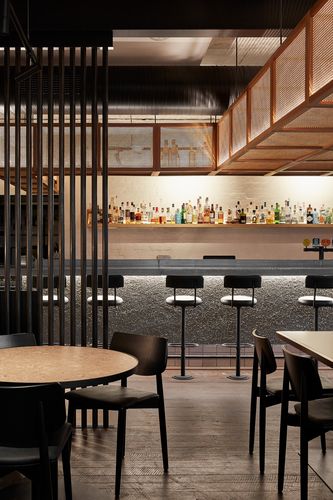
This screenshot has height=500, width=333. In order to click on line of liquor bottles in this screenshot , I will do `click(190, 215)`.